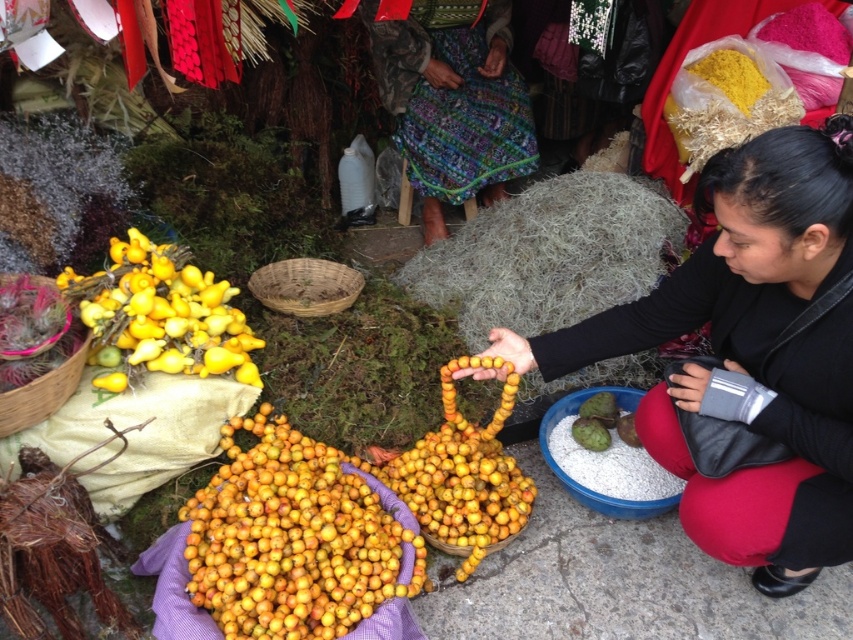
You are a customer at the market and want to buy the taller yellow matte fruit. Which one should you choose between the yellow matte fruit at center and the yellow matte fruit at left?

The yellow matte fruit at center is taller than the yellow matte fruit at left, so you should choose the yellow matte fruit at center.

You are a customer at the market and want to pick up the yellow matte fruit at center and the yellow matte fruit at left. Which one is positioned lower in the arrangement?

The yellow matte fruit at center is located below the yellow matte fruit at left, so the one at center is lower.